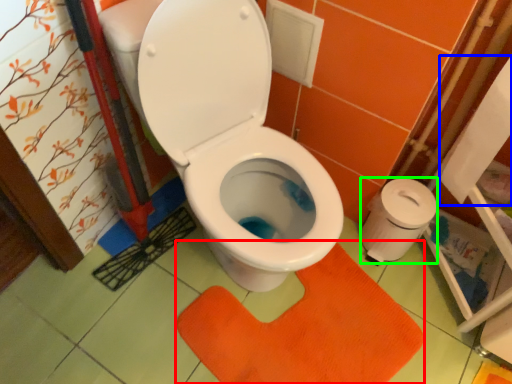
Question: Estimate the real-world distances between objects in this image. Which object is farther from doormat (highlighted by a red box), toilet paper (highlighted by a blue box) or toilet paper (highlighted by a green box)?

Choices:
 (A) toilet paper
 (B) toilet paper

Answer: (A)